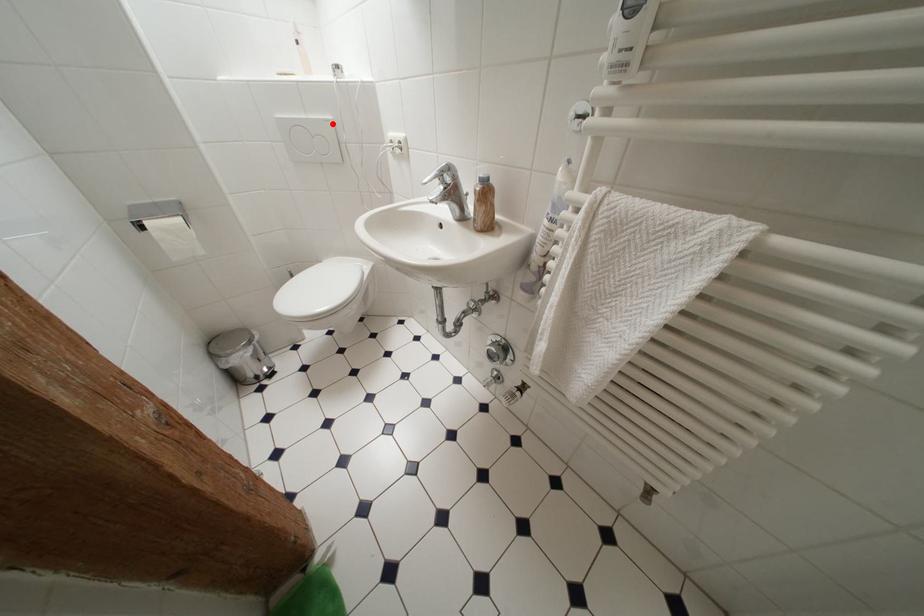
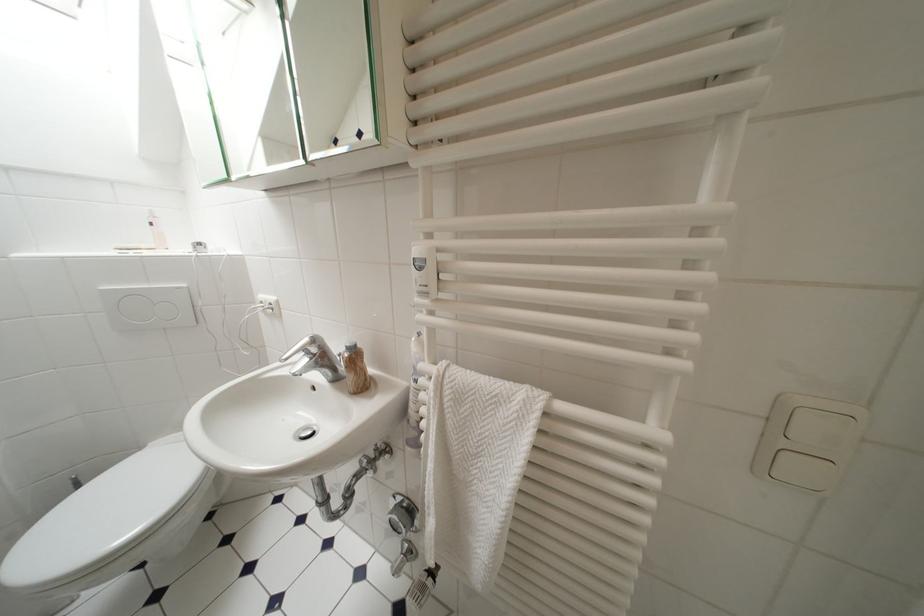
The point at the highlighted location is marked in the first image. Where is the corresponding point in the second image?

(185, 291)